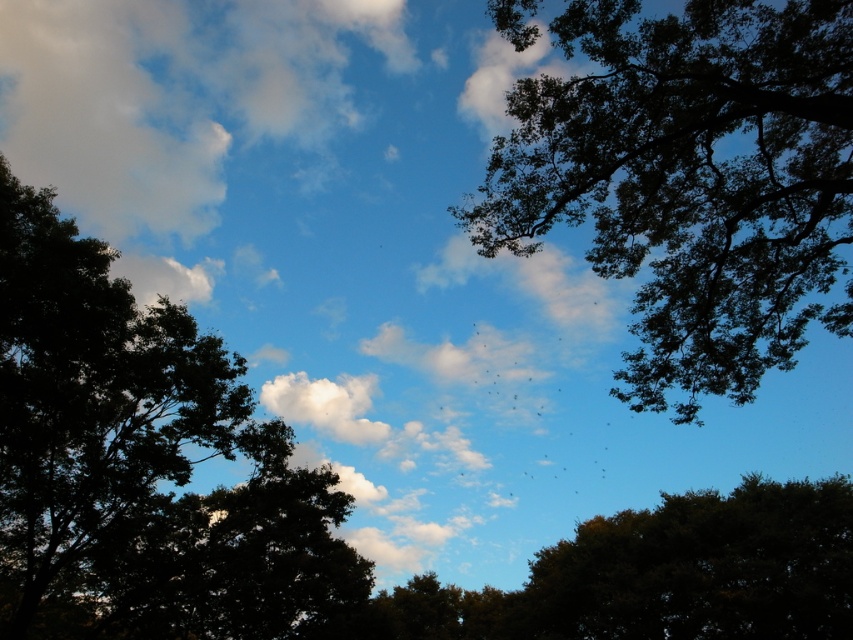
Who is positioned more to the right, dark green leafy tree at upper right or green leafy tree at center?

green leafy tree at center is more to the right.

Is point (694, 326) positioned after point (775, 557)?

No, it is in front of (775, 557).

Identify the location of dark green leafy tree at upper right. The image size is (853, 640). (691, 180).

Which is above, dark green leafy tree at upper left or green leafy tree at center?

Positioned higher is dark green leafy tree at upper left.

Is point (169, 442) positioned after point (807, 614)?

No.

Image resolution: width=853 pixels, height=640 pixels. What are the coordinates of `dark green leafy tree at upper left` in the screenshot? It's located at (141, 461).

Can you confirm if dark green leafy tree at upper right is thinner than dark green leafy tree at upper left?

Incorrect, dark green leafy tree at upper right's width is not less than dark green leafy tree at upper left's.

Is point (766, 284) less distant than point (163, 516)?

Yes, point (766, 284) is in front of point (163, 516).

Where is `dark green leafy tree at upper right`? dark green leafy tree at upper right is located at coordinates (691, 180).

Image resolution: width=853 pixels, height=640 pixels. In order to click on dark green leafy tree at upper right in this screenshot , I will do `click(691, 180)`.